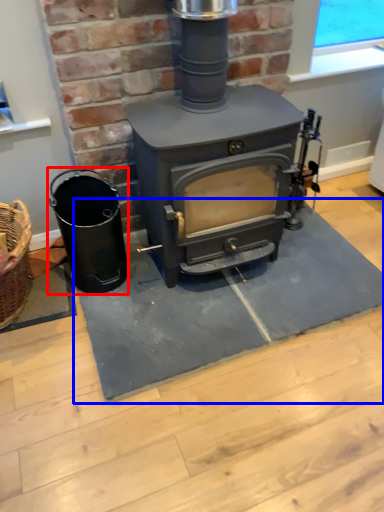
Question: Among these objects, which one is nearest to the camera, appliance (highlighted by a red box) or doormat (highlighted by a blue box)?

Choices:
 (A) appliance
 (B) doormat

Answer: (B)